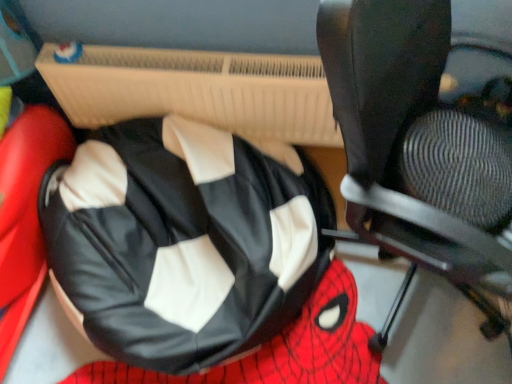
Measure the distance between black leather chair at center and camera.

They are 25.45 inches apart.

This screenshot has width=512, height=384. What do you see at coordinates (418, 147) in the screenshot? I see `black leather chair at center` at bounding box center [418, 147].

Find the location of `black leather chair at center`. black leather chair at center is located at coordinates (418, 147).

This screenshot has width=512, height=384. Find the location of `black leather bean bag at center`. black leather bean bag at center is located at coordinates (182, 242).

Describe the element at coordinates (182, 242) in the screenshot. The height and width of the screenshot is (384, 512). I see `black leather bean bag at center` at that location.

You are a GUI agent. You are given a task and a screenshot of the screen. Output one action in this format:
    pyautogui.click(x=<x>, y=<y>)
    Task: Click on the black leather chair at center
    
    Given the screenshot: What is the action you would take?
    pyautogui.click(x=418, y=147)

Based on their positions, is black leather bean bag at center located to the left or right of black leather chair at center?

black leather bean bag at center is to the left of black leather chair at center.

Is black leather bean bag at center positioned behind black leather chair at center?

Yes, black leather bean bag at center is further from the camera.

Considering the positions of points (85, 202) and (362, 32), is point (85, 202) farther from camera compared to point (362, 32)?

Yes, point (85, 202) is farther from viewer.

From the image's perspective, between black leather bean bag at center and black leather chair at center, which one is located above?

black leather chair at center, from the image's perspective.

From a real-world perspective, is black leather bean bag at center below black leather chair at center?

Yes.

Can you confirm if black leather bean bag at center is thinner than black leather chair at center?

Incorrect, the width of black leather bean bag at center is not less than that of black leather chair at center.

Does black leather bean bag at center have a lesser height compared to black leather chair at center?

Yes, black leather bean bag at center is shorter than black leather chair at center.

Looking at the image, does black leather bean bag at center seem bigger or smaller compared to black leather chair at center?

black leather bean bag at center is smaller than black leather chair at center.

Is black leather bean bag at center situated inside black leather chair at center or outside?

black leather bean bag at center is located beyond the bounds of black leather chair at center.

Is black leather bean bag at center not near black leather chair at center?

black leather bean bag at center is near black leather chair at center, not far away.

Is black leather bean bag at center oriented away from black leather chair at center?

No, black leather chair at center is not at the back of black leather bean bag at center.

Can you tell me how much black leather bean bag at center and black leather chair at center differ in facing direction?

There is a 57.2-degree angle between the facing directions of black leather bean bag at center and black leather chair at center.

The width and height of the screenshot is (512, 384). In order to click on chair located above the black leather bean bag at center (from the image's perspective) in this screenshot , I will do `click(418, 147)`.

Which object is positioned more to the right, black leather chair at center or black leather bean bag at center?

From the viewer's perspective, black leather chair at center appears more on the right side.

Is the depth of black leather chair at center less than that of black leather bean bag at center?

Yes, black leather chair at center is closer to the camera.

Does point (349, 53) lie behind point (151, 136)?

No.

From the image's perspective, is black leather chair at center located beneath black leather bean bag at center?

No, from the image's perspective, black leather chair at center is not beneath black leather bean bag at center.

From a real-world perspective, which is physically below, black leather chair at center or black leather bean bag at center?

black leather bean bag at center, from a real-world perspective.

Considering the relative sizes of black leather chair at center and black leather bean bag at center in the image provided, is black leather chair at center wider than black leather bean bag at center?

Incorrect, the width of black leather chair at center does not surpass that of black leather bean bag at center.

Can you confirm if black leather chair at center is shorter than black leather bean bag at center?

No, black leather chair at center is not shorter than black leather bean bag at center.

Is black leather chair at center smaller than black leather bean bag at center?

No, black leather chair at center is not smaller than black leather bean bag at center.

Is black leather chair at center not within black leather bean bag at center?

Yes, black leather chair at center is not within black leather bean bag at center.

Can you see black leather chair at center touching black leather bean bag at center?

No, black leather chair at center is not beside black leather bean bag at center.

Is black leather chair at center looking in the opposite direction of black leather bean bag at center?

No, black leather bean bag at center is not at the back of black leather chair at center.

What's the angular difference between black leather chair at center and black leather bean bag at center's facing directions?

57.2 degrees.

Where is `chair above the black leather bean bag at center (from a real-world perspective)`? Image resolution: width=512 pixels, height=384 pixels. chair above the black leather bean bag at center (from a real-world perspective) is located at coordinates (418, 147).

I want to click on bean bag chair that is below the black leather chair at center (from the image's perspective), so click(x=182, y=242).

Locate an element on the screen. This screenshot has width=512, height=384. chair lying on the right of black leather bean bag at center is located at coordinates (418, 147).